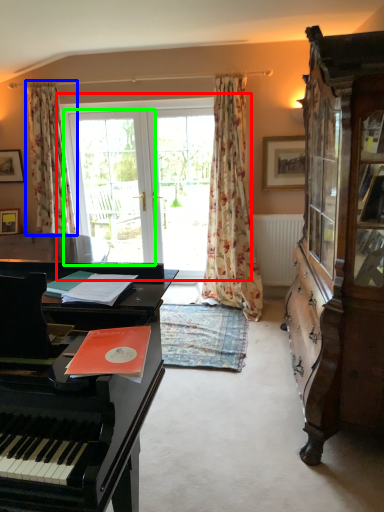
Question: Which is farther away from bay window (highlighted by a red box)? curtain (highlighted by a blue box) or screen door (highlighted by a green box)?

Choices:
 (A) curtain
 (B) screen door

Answer: (A)